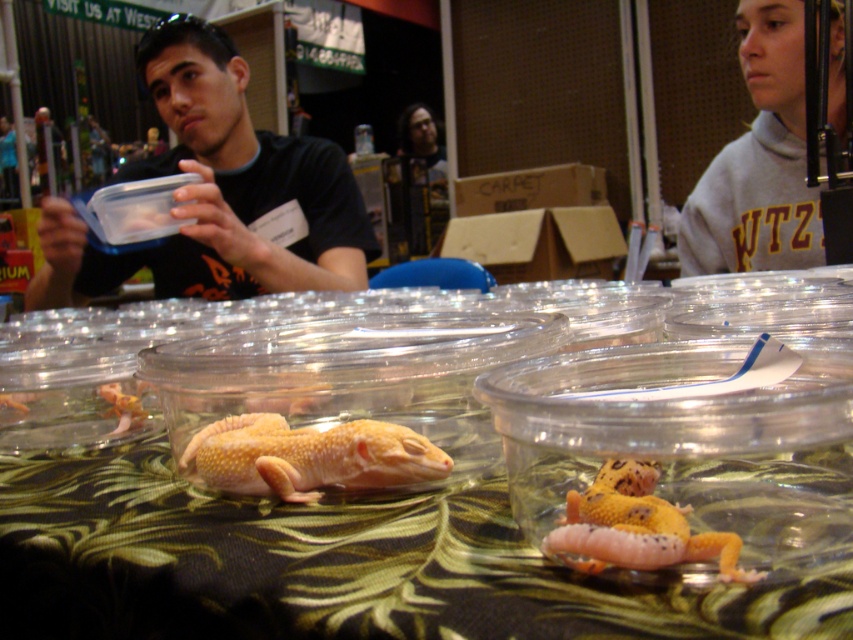
Does point (682, 220) come farther from viewer compared to point (592, 531)?

Yes, point (682, 220) is farther from viewer.

What do you see at coordinates (759, 161) in the screenshot? The height and width of the screenshot is (640, 853). I see `gray fleece sweatshirt at upper right` at bounding box center [759, 161].

Between point (776, 106) and point (735, 573), which one is positioned in front?

Positioned in front is point (735, 573).

Find the location of a particular element. This screenshot has height=640, width=853. gray fleece sweatshirt at upper right is located at coordinates (759, 161).

Does gray fleece sweatshirt at upper right appear over yellowish matte lizard at center?

Indeed, gray fleece sweatshirt at upper right is positioned over yellowish matte lizard at center.

Measure the distance between point (x=764, y=120) and camera.

Point (x=764, y=120) and camera are 1.85 meters apart.

Find the location of a particular element. This screenshot has width=853, height=640. gray fleece sweatshirt at upper right is located at coordinates (759, 161).

Which is below, yellowish matte lizard at center or yellow matte lizard at center?

yellow matte lizard at center is below.

Which is behind, point (238, 449) or point (631, 568)?

Point (238, 449)

Locate an element on the screen. yellowish matte lizard at center is located at coordinates (310, 456).